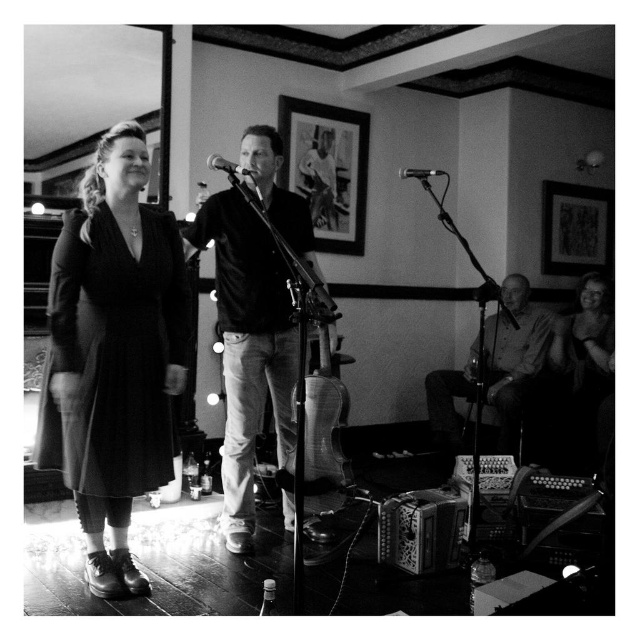
You are a photographer adjusting your camera to focus on two points in the image. The first point is labeled as point (499, 436) and the second is point (442, 173). Which point is closer to the camera?

Point (499, 436) is in front of point (442, 173), so it is closer to the camera.

You are a photographer setting up for a live event. You need to position a camera to capture both the smooth wooden guitar at lower right and the metallic silver microphone at upper center clearly. Based on their positions, which object should you focus on first if you want to ensure both are in frame without moving the camera?

The smooth wooden guitar at lower right is below the metallic silver microphone at upper center, so you should focus on the metallic silver microphone at upper center first to ensure the camera frame includes both objects from top to bottom.